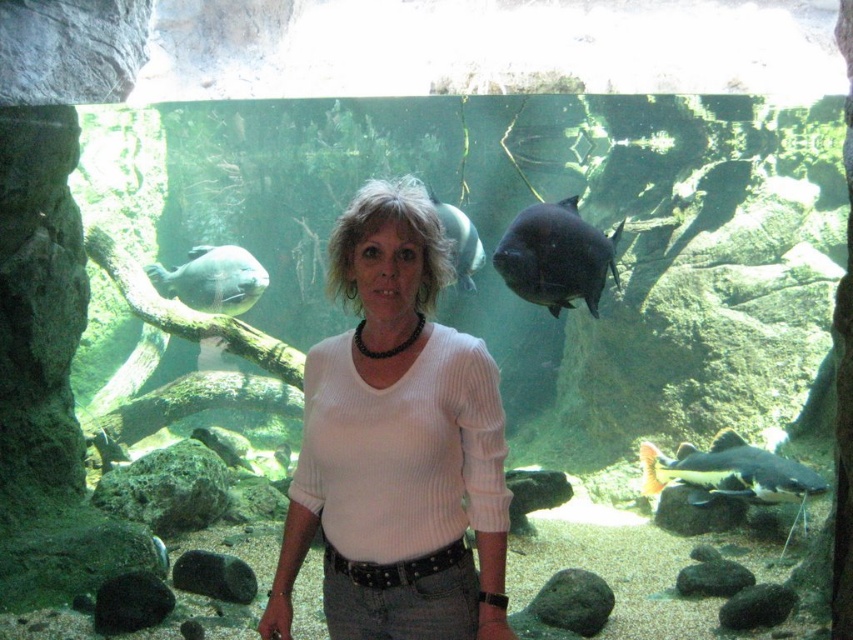
Does white ribbed sweater at center appear on the right side of black matte fish at center?

In fact, white ribbed sweater at center is to the left of black matte fish at center.

From the picture: Is white ribbed sweater at center bigger than black matte fish at center?

Yes, white ribbed sweater at center is bigger than black matte fish at center.

Image resolution: width=853 pixels, height=640 pixels. I want to click on white ribbed sweater at center, so click(x=397, y=445).

Is point (583, 250) farther from camera compared to point (466, 278)?

No, (583, 250) is in front of (466, 278).

Between point (583, 268) and point (463, 276), which one is positioned behind?

Positioned behind is point (463, 276).

Which is in front, point (595, 230) or point (466, 266)?

Point (595, 230) is more forward.

Locate an element on the screen. black matte fish at center is located at coordinates (555, 257).

Can you confirm if shiny gray fish at left is smaller than shiny silver fish at center?

Incorrect, shiny gray fish at left is not smaller in size than shiny silver fish at center.

The image size is (853, 640). What do you see at coordinates (212, 280) in the screenshot?
I see `shiny gray fish at left` at bounding box center [212, 280].

The width and height of the screenshot is (853, 640). Identify the location of shiny gray fish at left. (212, 280).